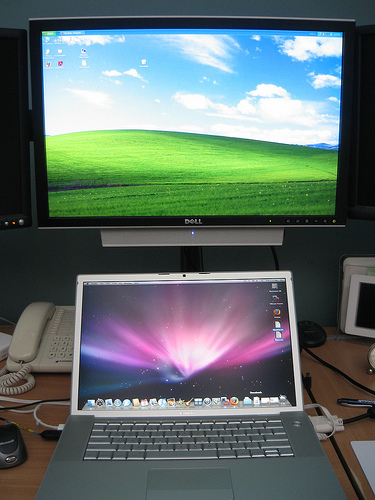
At what (x,y) coordinates should I click in order to perform the action: click on phone push buttons. Please return your answer as a coordinate pair (x, y). This screenshot has height=500, width=375. Looking at the image, I should click on (51, 355), (52, 347), (54, 342), (56, 337), (65, 338), (65, 344), (64, 348), (62, 353), (69, 353), (72, 347).